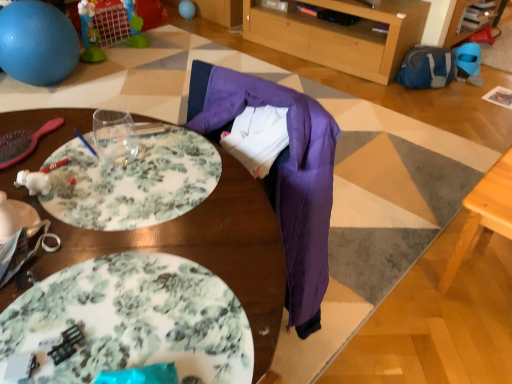
Locate an element on the screen. empty space that is to the right of white glossy plate at lower left, placed as the 1th plate when sorted from left to right is located at coordinates (106, 247).